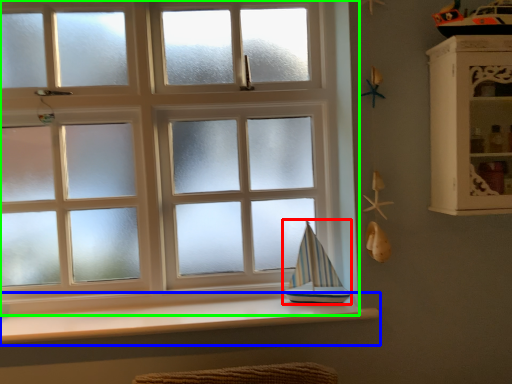
Question: Which object is positioned closest to sailboat (highlighted by a red box)? Select from window sill (highlighted by a blue box) and window (highlighted by a green box).

Choices:
 (A) window sill
 (B) window

Answer: (A)